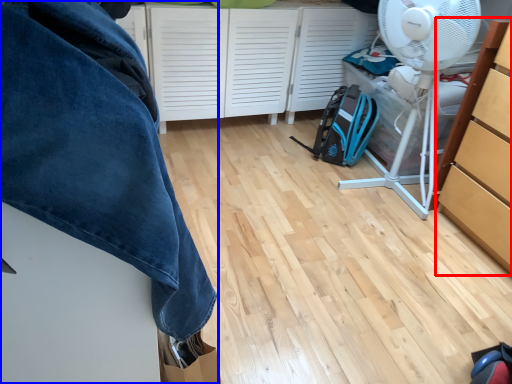
Question: Which object is further to the camera taking this photo, cabinetry (highlighted by a red box) or furniture (highlighted by a blue box)?

Choices:
 (A) cabinetry
 (B) furniture

Answer: (A)